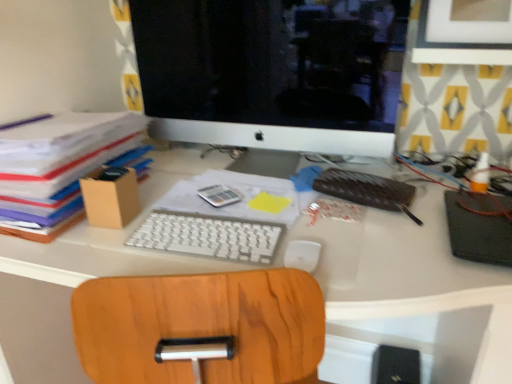
This screenshot has height=384, width=512. In order to click on blank space situated above white plastic keyboard at center (from a real-world perspective) in this screenshot , I will do `click(207, 230)`.